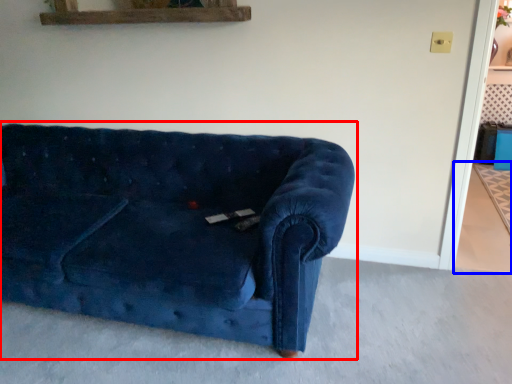
Question: Which of the following is the closest to the observer, studio couch (highlighted by a red box) or concrete (highlighted by a blue box)?

Choices:
 (A) studio couch
 (B) concrete

Answer: (A)